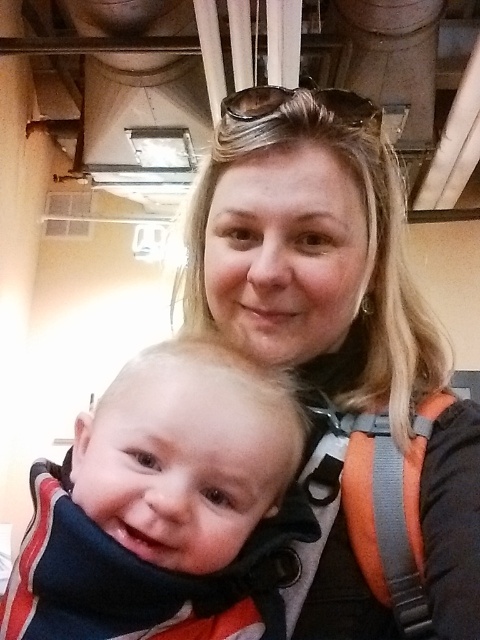
You are a photographer trying to capture a candid shot of the blonde hair at center and the soft white scarf at center. Which object should you zoom in on more to ensure both are in focus?

The blonde hair at center is bigger than the soft white scarf at center, so you should zoom in more on the soft white scarf at center to ensure both are in focus.